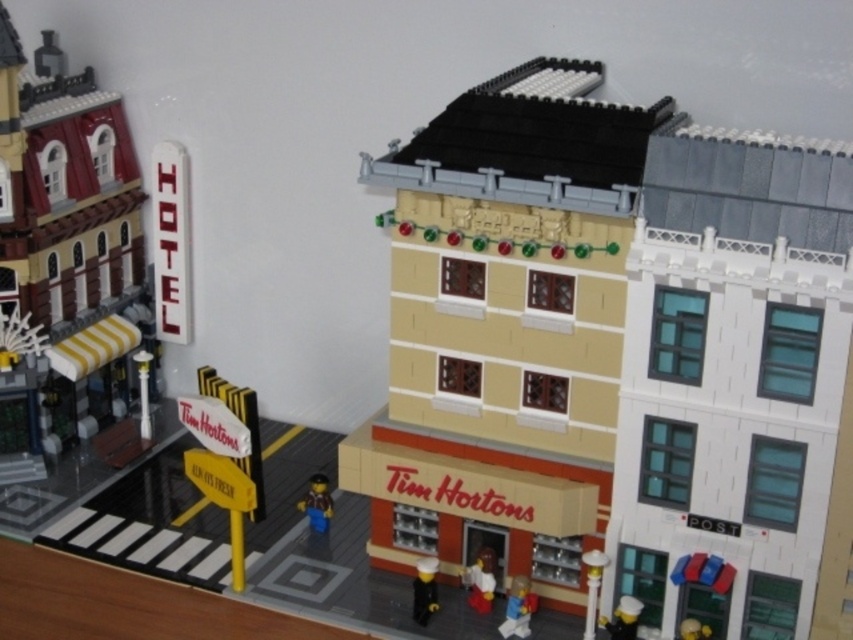
You are a small toy car that wants to drive from the matte black toy at lower center to the yellow striped awning at left. Can you drive directly towards the awning without any obstacles blocking your path?

The yellow striped awning at left is further to the viewer than the matte black toy at lower center, meaning the awning is closer to you. Since the awning is closer, you can drive directly towards it without any obstacles blocking your path.

You are a toy car that is 10 cm long. You want to drive under the yellow striped awning at left and the matte red chef hat at center. Which structure can you pass under without hitting your roof?

The yellow striped awning at left is bigger than matte red chef hat at center, so the toy car can pass under the yellow striped awning at left without hitting its roof, but the matte red chef hat at center is too small.